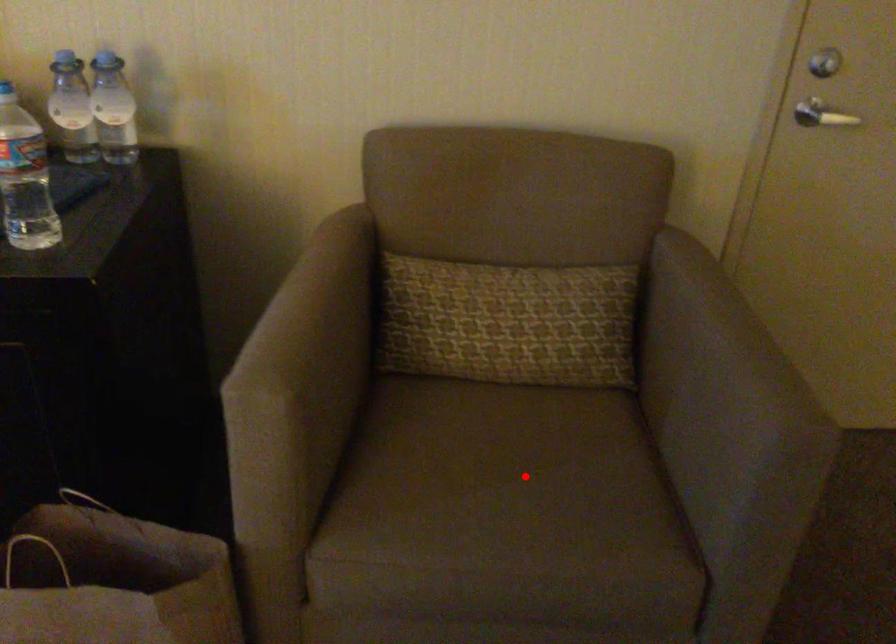
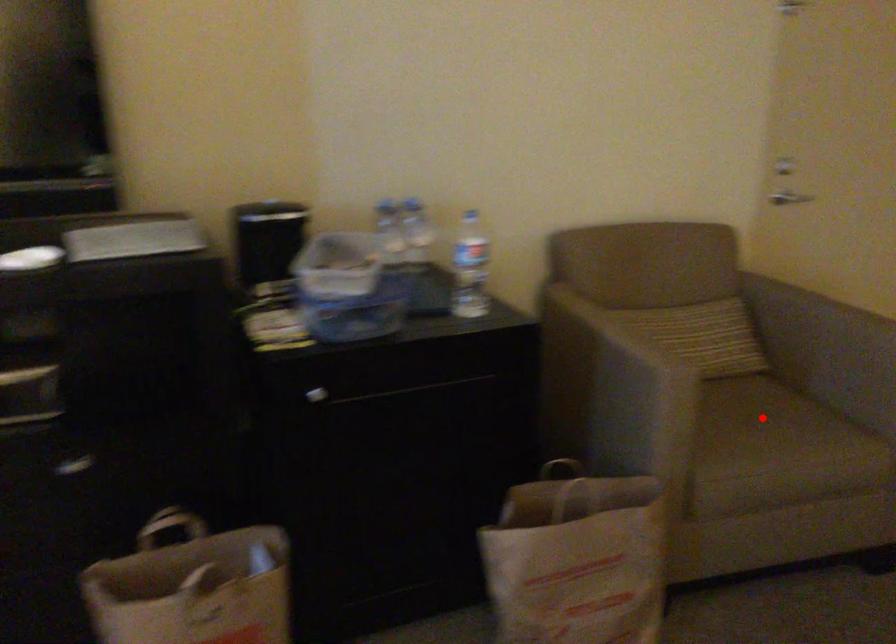
I am providing you with two images of the same scene from different viewpoints. A red point is marked on the first image and another point is marked on the second image. Is the marked point in image1 the same physical position as the marked point in image2?

Yes